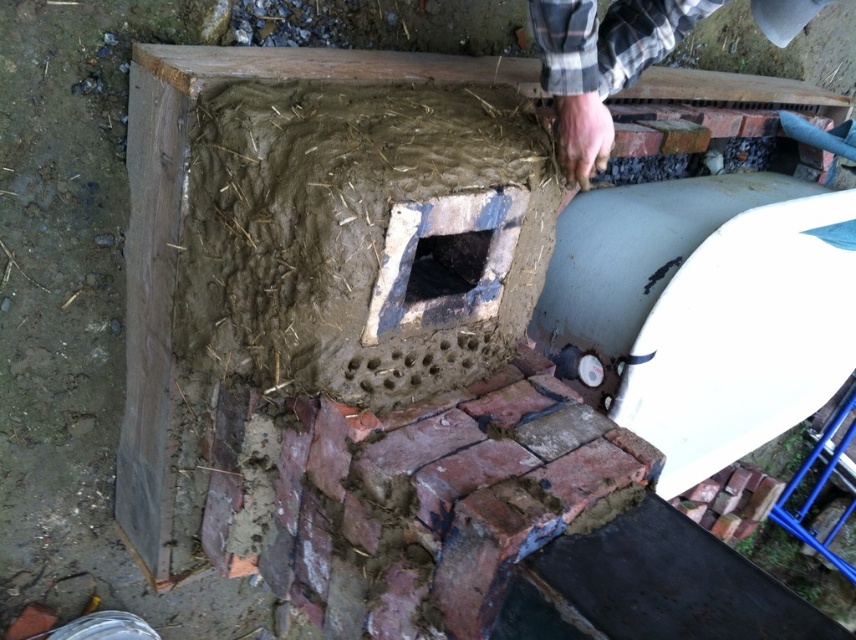
Looking at this image, you are a construction worker who needs to place a new brick into the black concrete hole at center. However, there is a plaid flannel shirt at upper right nearby. Which object is taller so you can decide where to step carefully?

The plaid flaid shirt at upper right is much taller than the black concrete hole at center, so you should step carefully around the plaid flannel shirt at upper right to avoid bumping into it while placing the brick into the black concrete hole at center.

You are standing in front of a partially constructed brick oven and notice a plaid flannel shirt at upper right. If you want to grab the shirt without moving your feet, is it within your reach?

The plaid flannel shirt at upper right is 1.19 meters away from you, so it is within reach if your arm can extend that far. However, this depends on your arm length and whether there are obstacles between you and the shirt.